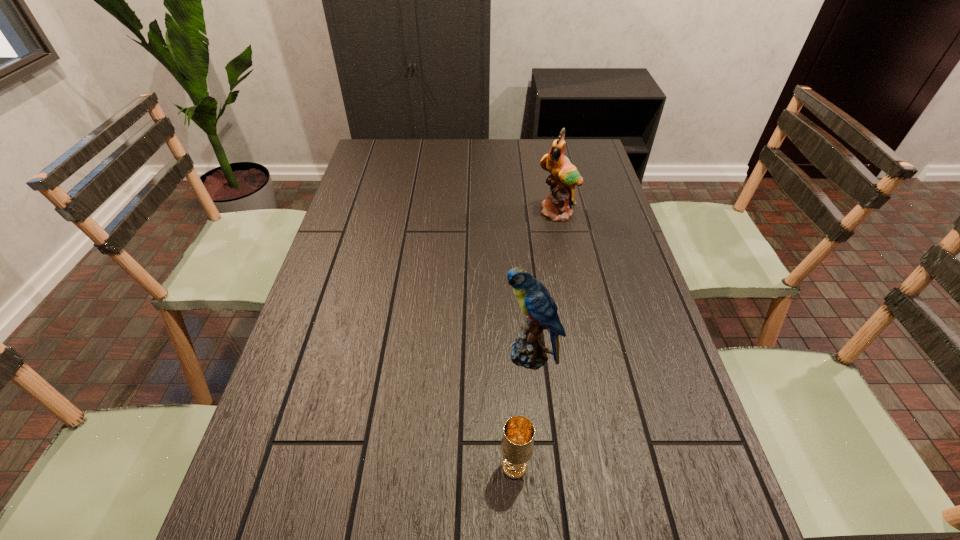
Identify the location of vacant space in between the second farthest object and the farthest object. (544, 284).

Choose which object is the nearest neighbor to the farthest object. Please provide its 2D coordinates. Your answer should be formatted as a tuple, i.e. [(x, y)], where the tuple contains the x and y coordinates of a point satisfying the conditions above.

[(528, 350)]

Locate an element on the screen. This screenshot has height=540, width=960. object that stands as the closest to the second farthest object is located at coordinates point(517,445).

Identify the location of free location that satisfies the following two spatial constraints: 1. on the front-facing side of the rightmost object; 2. on the face of the second nearest object. This screenshot has height=540, width=960. (588, 355).

Where is `free point that satisfies the following two spatial constraints: 1. on the front-facing side of the farther parrot; 2. on the face of the second nearest object`? free point that satisfies the following two spatial constraints: 1. on the front-facing side of the farther parrot; 2. on the face of the second nearest object is located at coordinates (588, 355).

Locate an element on the screen. vacant space that satisfies the following two spatial constraints: 1. on the face of the left parrot; 2. on the front side of the chalice is located at coordinates (540, 467).